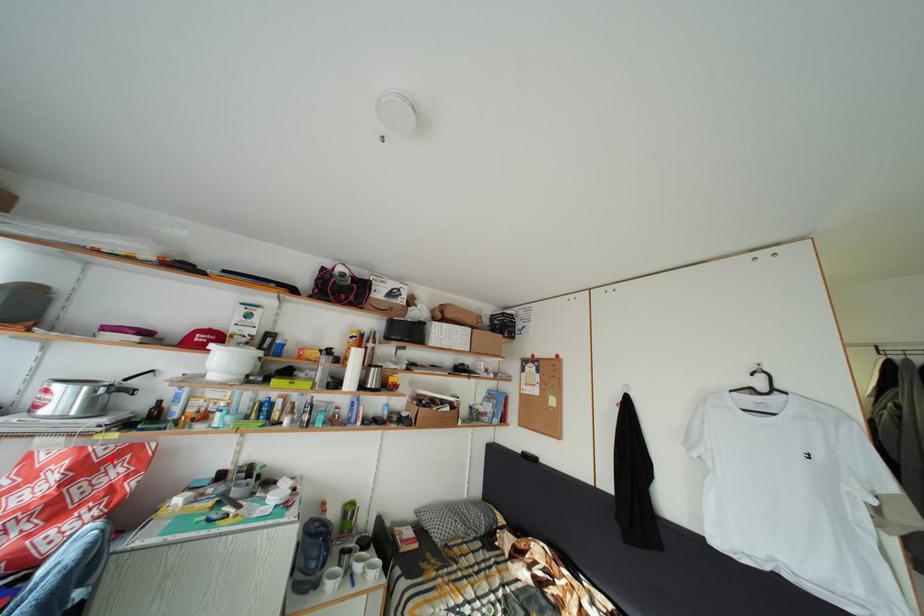
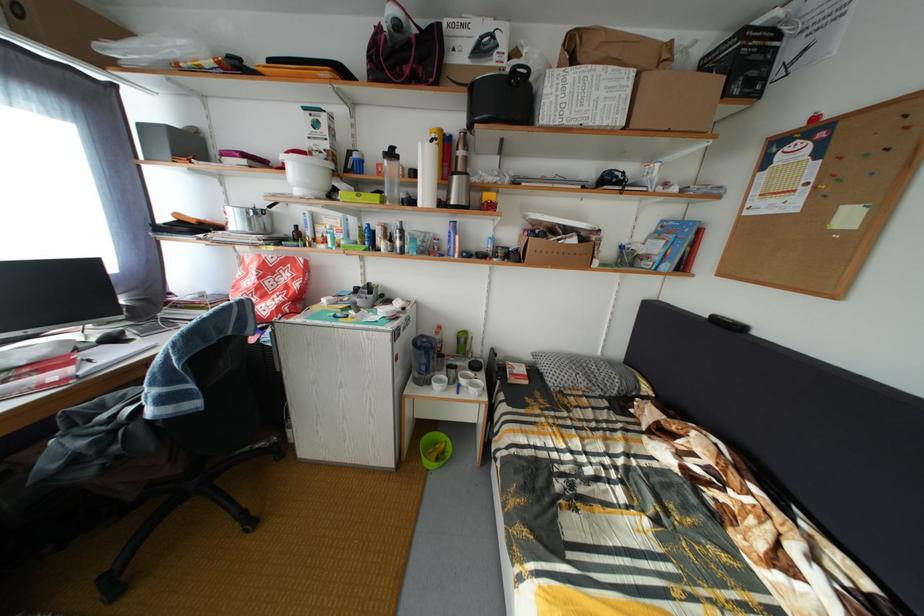
The point at the highlighted location is marked in the first image. Where is the corresponding point in the second image?

(281, 267)